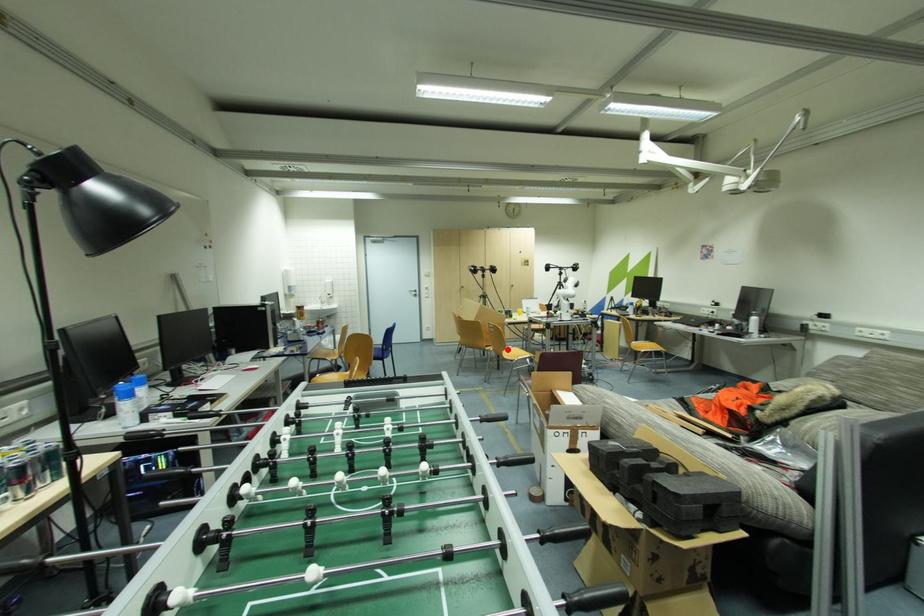
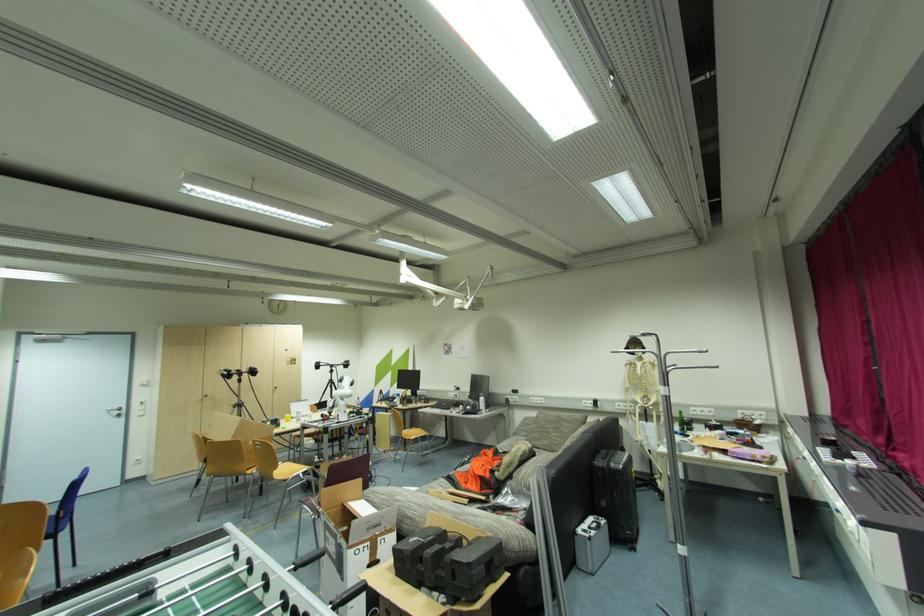
Where in the second image is the point corresponding to the highlighted location from the first image?

(280, 469)